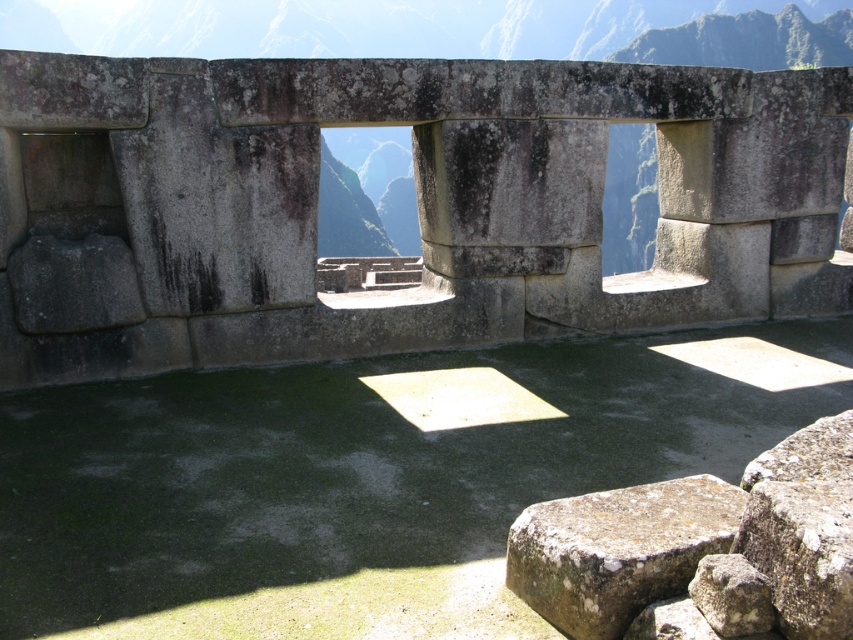
You are standing on the ancient stone terrace at Machu Picchu and notice a specific point marked at coordinates (366, 193). Which structure does this point belong to?

The point at (366, 193) is on the gray stone wall at center.

You are a tour guide explaining the ancient stone structures of Machu Picchu to visitors. You point out the gray stone wall at center and the rusty stone at lower right. Which of these two objects is taller?

The gray stone wall at center is taller than the rusty stone at lower right.